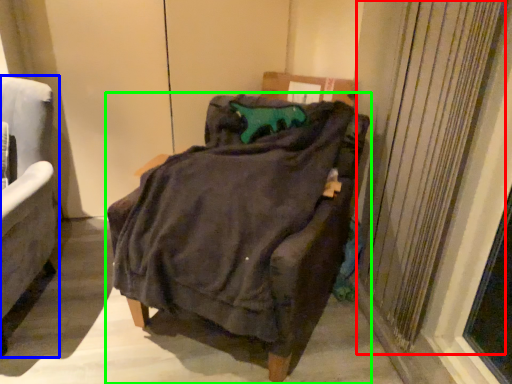
Question: Estimate the real-world distances between objects in this image. Which object is farther from curtain (highlighted by a red box), chair (highlighted by a blue box) or chair (highlighted by a green box)?

Choices:
 (A) chair
 (B) chair

Answer: (A)